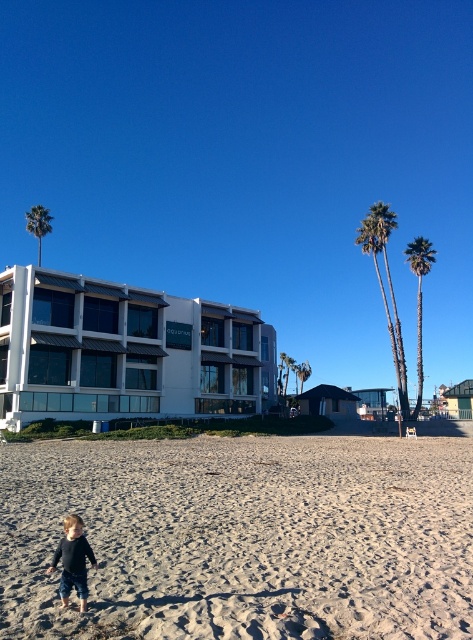
You are standing at the center of the beach and want to take a photo of the green leafy palm tree at right. Which direction should you face to ensure the tree is in your camera view?

You should face towards the right direction to ensure the green leafy palm tree at right is in your camera view since it is located at point (420,301) which is to the right side of the image.

You are standing at the beach and want to take a photo of the green leafy palm trees at upper right. If your camera has a maximum zoom range of 50 meters, will you be able to capture the palm trees clearly?

The green leafy palm trees at upper right and the camera are 44.55 meters apart. Since the camera can zoom up to 50 meters, it is within the maximum range, so yes, you can capture the palm trees clearly.

You are standing at the beach and want to know how far the point marked at coordinates (420, 355) is from you. Can you determine the distance?

The point marked at coordinates (420, 355) is 44.00 meters away from you.